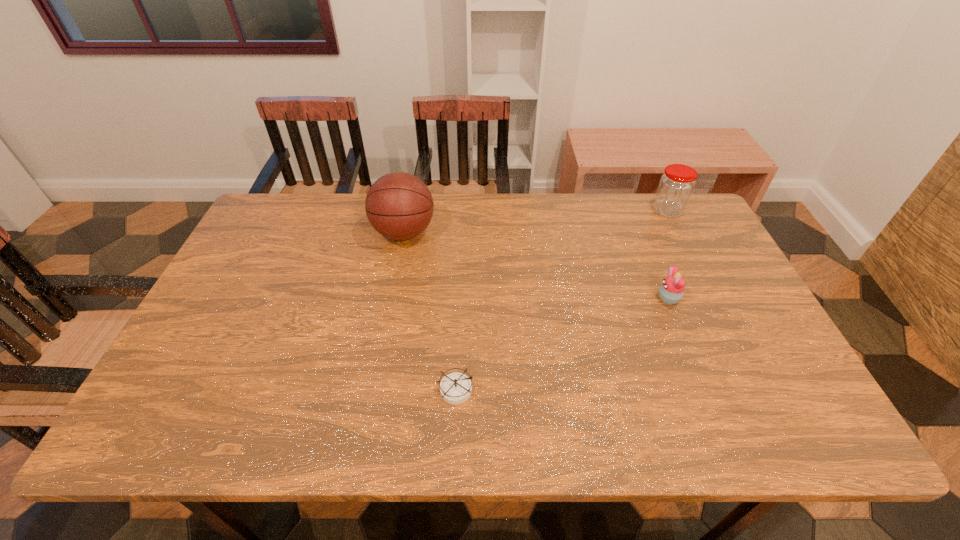
At what (x,y) coordinates should I click in order to perform the action: click on the tallest object. Please return your answer as a coordinate pair (x, y). This screenshot has width=960, height=540. Looking at the image, I should click on (399, 206).

This screenshot has height=540, width=960. What are the coordinates of `the leftmost object` in the screenshot? It's located at (399, 206).

Locate an element on the screen. The image size is (960, 540). the third shortest object is located at coordinates (676, 185).

At what (x,y) coordinates should I click in order to perform the action: click on the rightmost object. Please return your answer as a coordinate pair (x, y). The image size is (960, 540). Looking at the image, I should click on (676, 185).

In order to click on cupcake in this screenshot , I will do `click(671, 290)`.

Find the location of a particular element. The width and height of the screenshot is (960, 540). the second nearest object is located at coordinates (671, 290).

Where is `the shortest object`? The image size is (960, 540). the shortest object is located at coordinates (455, 388).

Identify the location of the third object from right to left. Image resolution: width=960 pixels, height=540 pixels. (455, 388).

At what (x,y) coordinates should I click in order to perform the action: click on vacant space situated 0.150m on the front of the leftmost object. Please return your answer as a coordinate pair (x, y). The image size is (960, 540). Looking at the image, I should click on (393, 290).

The image size is (960, 540). In order to click on free region located 0.100m on the left of the jar in this screenshot , I will do `click(622, 211)`.